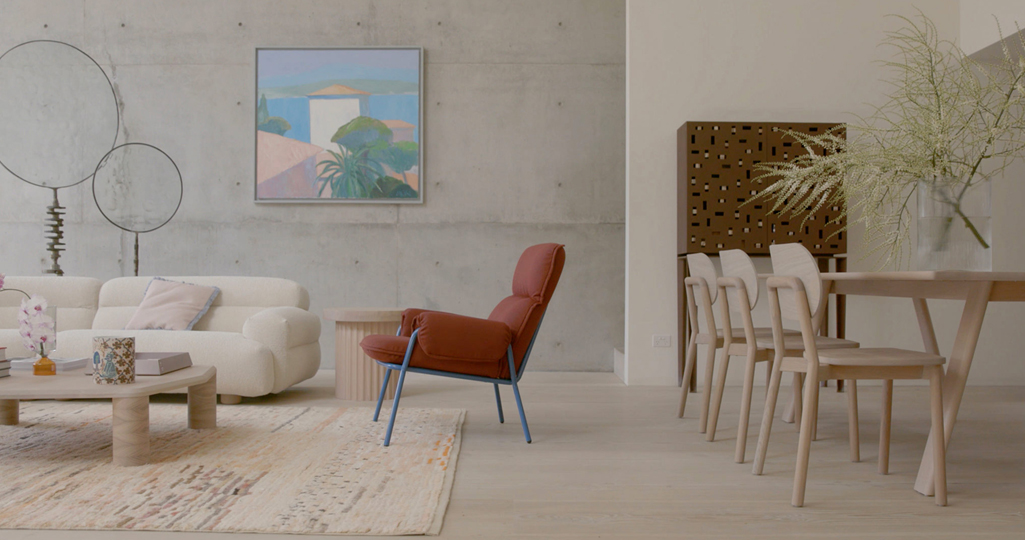
Where is `floor to the right of the rug`? Image resolution: width=1025 pixels, height=540 pixels. floor to the right of the rug is located at coordinates (587, 471).